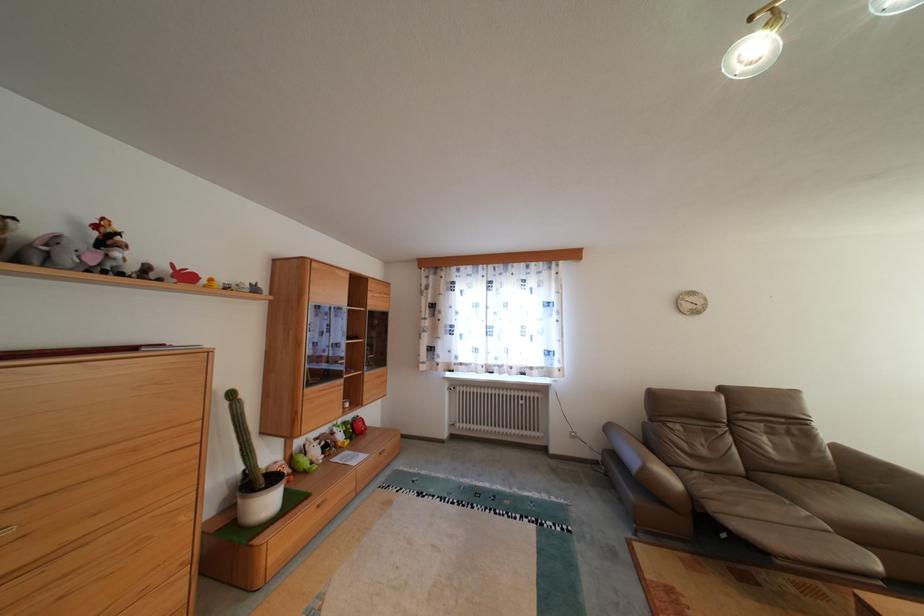
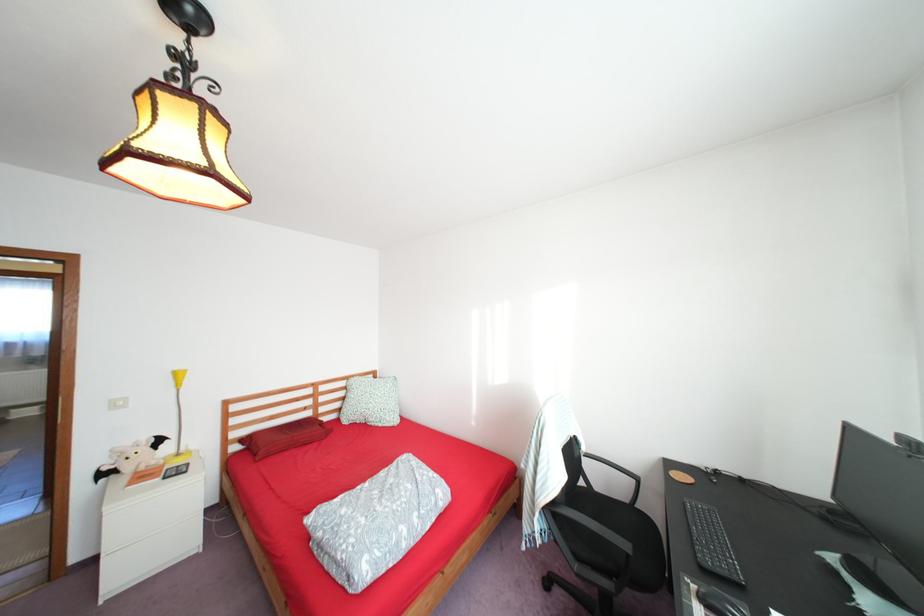
Question: I am providing you with two images of the same scene from different viewpoints. Please identify which objects are invisible in image2.

Choices:
 (A) yellow table lamp
 (B) brown sofa armrest
 (C) patterned square pillow
 (D) blue desk organizer

Answer: (B)